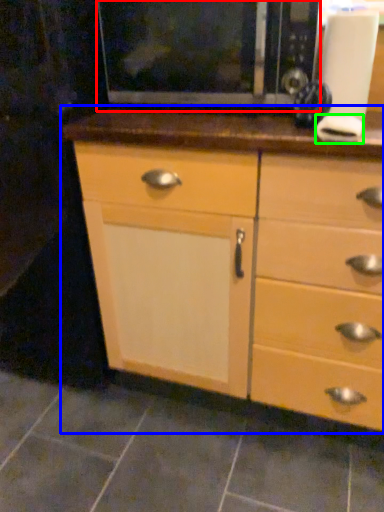
Question: Which is farther away from microwave (highlighted by a red box)? chest of drawers (highlighted by a blue box) or knob (highlighted by a green box)?

Choices:
 (A) chest of drawers
 (B) knob

Answer: (A)